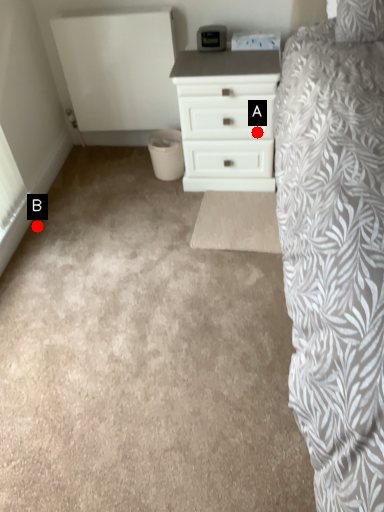
Question: Two points are circled on the image, labeled by A and B beside each circle. Which point is further to the camera?

Choices:
 (A) A is further
 (B) B is further

Answer: (B)